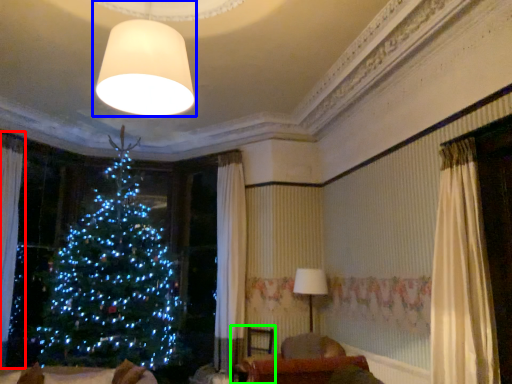
Question: Estimate the real-world distances between objects in this image. Which object is closer to curtain (highlighted by a red box), lamp (highlighted by a blue box) or armchair (highlighted by a green box)?

Choices:
 (A) lamp
 (B) armchair

Answer: (B)